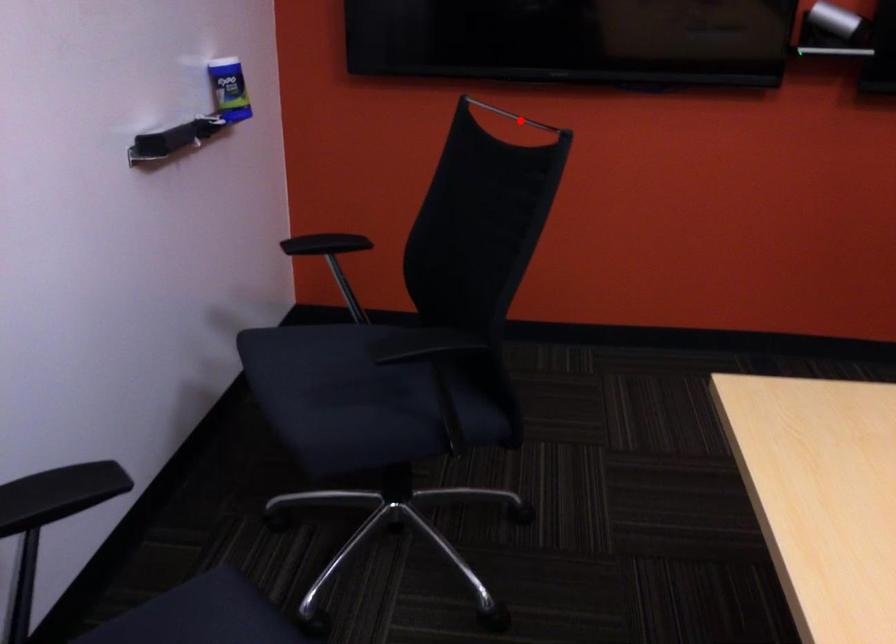
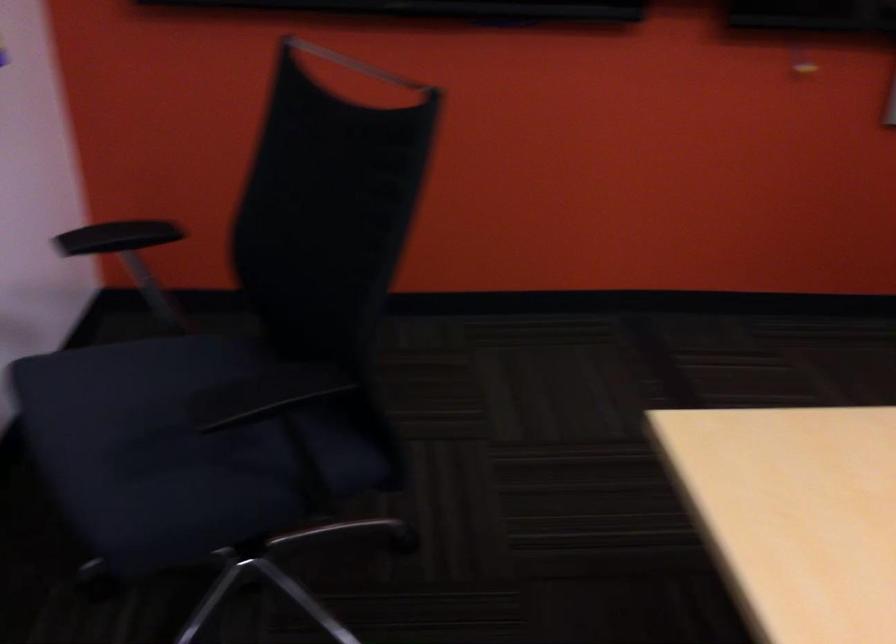
Question: I am providing you with two images of the same scene from different viewpoints. A red point is shown in image1. For the corresponding object point in image2, is it positioned nearer or farther from the camera?

Choices:
 (A) Nearer
 (B) Farther

Answer: (A)